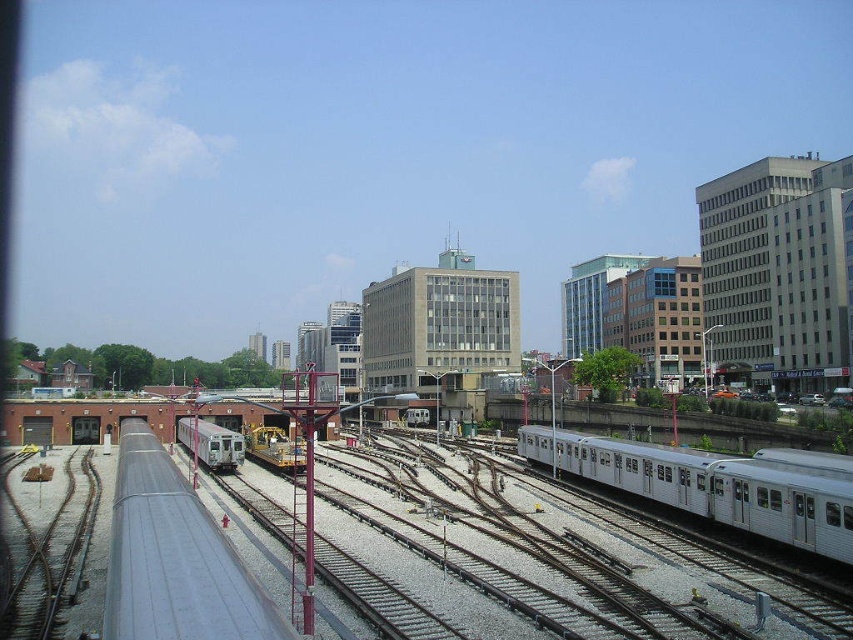
Does silver metallic train at right have a greater height compared to silver metallic train at lower left?

No, silver metallic train at right is not taller than silver metallic train at lower left.

Is point (606, 461) more distant than point (225, 429)?

No, it is in front of (225, 429).

Which is in front, point (763, 516) or point (228, 429)?

Positioned in front is point (763, 516).

Identify the location of silver metallic train at right. The height and width of the screenshot is (640, 853). (711, 484).

Does gray metallic track at lower left have a greater width compared to silver metallic train at lower left?

Yes, gray metallic track at lower left is wider than silver metallic train at lower left.

Where is `gray metallic track at lower left`? gray metallic track at lower left is located at coordinates coord(51,556).

Does point (74, 564) lie behind point (212, 429)?

No, (74, 564) is closer to viewer.

Find the location of a particular element. The width and height of the screenshot is (853, 640). gray metallic track at lower left is located at coordinates (51, 556).

Is point (682, 472) farther from viewer compared to point (76, 561)?

Yes, it is behind point (76, 561).

Who is higher up, silver metallic train at right or gray metallic track at lower left?

silver metallic train at right is above.

Is point (822, 470) positioned after point (15, 588)?

Yes, point (822, 470) is farther from viewer.

Identify the location of silver metallic train at right. click(x=711, y=484).